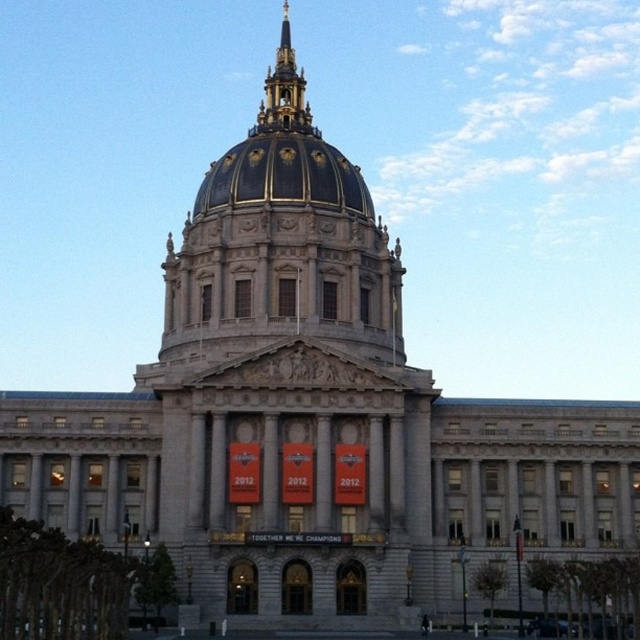
Question: Is gray stone dome at center further to the viewer compared to blue-golden dome at center?

Choices:
 (A) no
 (B) yes

Answer: (A)

Question: Can you confirm if gray stone dome at center is positioned to the left of gold/gilded spire at upper center?

Choices:
 (A) no
 (B) yes

Answer: (A)

Question: Considering the real-world distances, which object is closest to the gray stone dome at center?

Choices:
 (A) blue-golden dome at center
 (B) gold/gilded spire at upper center

Answer: (A)

Question: Which object appears farthest from the camera in this image?

Choices:
 (A) blue-golden dome at center
 (B) gold/gilded spire at upper center

Answer: (B)

Question: Can you confirm if gray stone dome at center is positioned below blue-golden dome at center?

Choices:
 (A) no
 (B) yes

Answer: (B)

Question: Which point appears farthest from the camera in this image?

Choices:
 (A) (x=358, y=212)
 (B) (x=278, y=83)
 (C) (x=365, y=573)

Answer: (B)